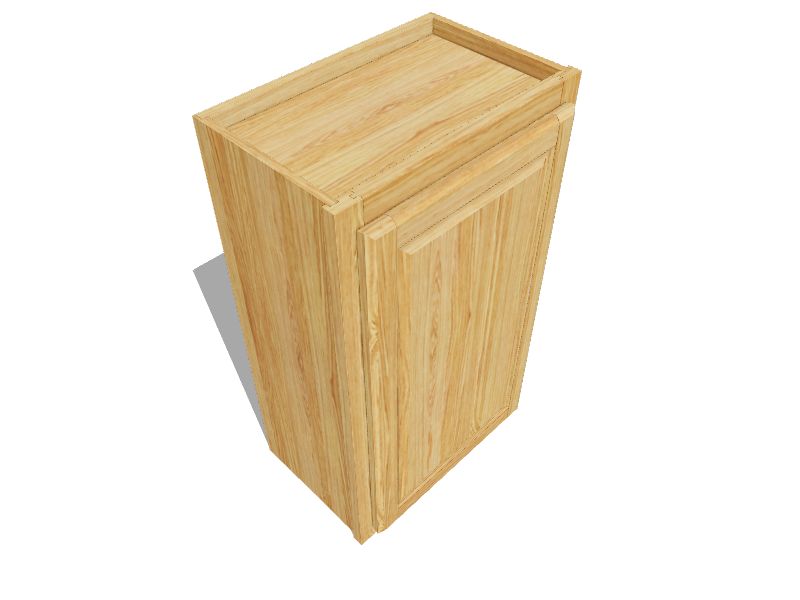
You are a GUI agent. You are given a task and a screenshot of the screen. Output one action in this format:
    pyautogui.click(x=<x>, y=<y>)
    Task: Click on the light portion of the wood grain
    
    Given the screenshot: What is the action you would take?
    pyautogui.click(x=352, y=108), pyautogui.click(x=373, y=140), pyautogui.click(x=417, y=314), pyautogui.click(x=270, y=259), pyautogui.click(x=309, y=290), pyautogui.click(x=441, y=339)